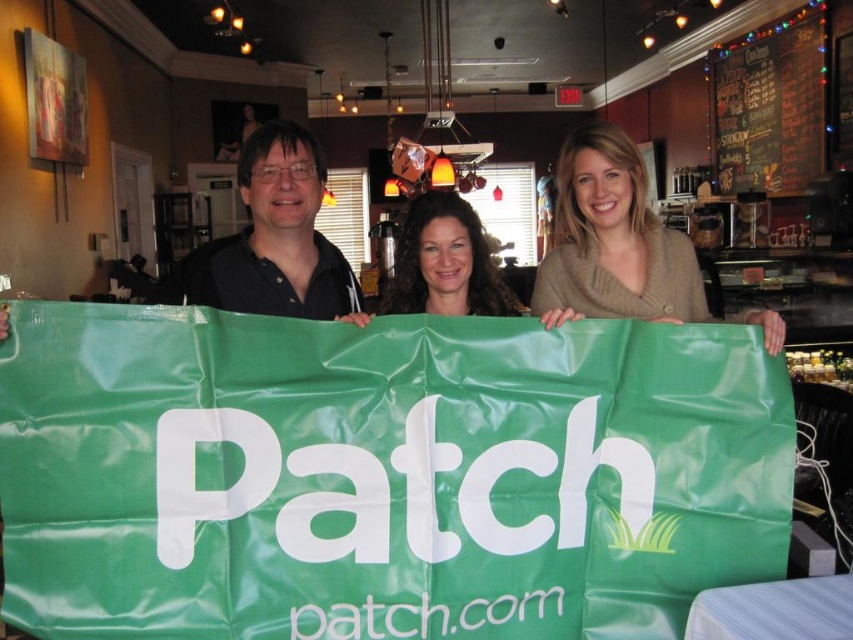
Who is shorter, green fabric banner at center or matte beige sweater at center?

Standing shorter between the two is matte beige sweater at center.

Between point (223, 525) and point (630, 301), which one is positioned in front?

Point (223, 525)

Identify the location of green fabric banner at center. (381, 474).

Which is above, green fabric banner at center or black chalkboard menu at upper right?

black chalkboard menu at upper right is higher up.

Is green fabric banner at center shorter than black chalkboard menu at upper right?

Indeed, green fabric banner at center has a lesser height compared to black chalkboard menu at upper right.

Is point (369, 420) in front of point (711, 129)?

Yes, it is.

Where is `green fabric banner at center`? The width and height of the screenshot is (853, 640). green fabric banner at center is located at coordinates (381, 474).

Which is in front, point (229, 372) or point (434, 304)?

Point (229, 372) is in front.

Who is higher up, green fabric banner at center or curly brown hair at center?

Positioned higher is curly brown hair at center.

Is point (190, 419) closer to camera compared to point (421, 264)?

Yes, it is in front of point (421, 264).

In order to click on green fabric banner at center in this screenshot , I will do [381, 474].